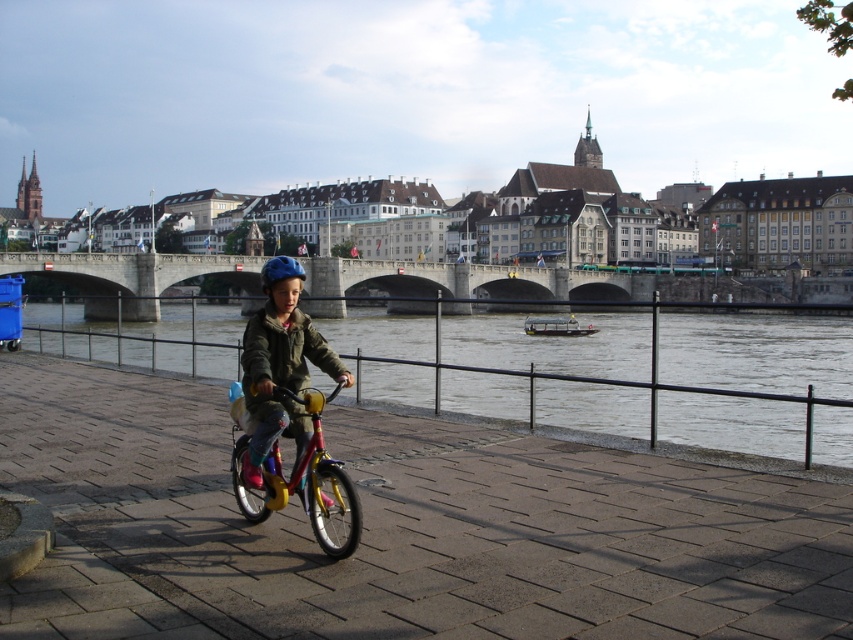
You are a pedestrian standing on the riverside promenade. You see the matte blue helmet at center and the metallic yellow bicycle at center. Which object is closer to you?

The matte blue helmet at center is closer to you because the metallic yellow bicycle at center is behind it.

Based on the photo, you are standing at the starting point of the riverside promenade and want to reach the stone bridge at center. According to the coordinates provided, what are the exact coordinates you need to navigate to?

The exact coordinates for the stone bridge at center are 0.448 on the x axis and 0.553 on the y axis.

You are a photographer trying to capture the child riding the metallic yellow bicycle at center. You notice the matte blue helmet at center is blocking part of the bicycle in your shot. Can you adjust your position to avoid the helmet while keeping the bicycle in frame?

The matte blue helmet at center is larger in size than the metallic yellow bicycle at center, so adjusting your position to avoid the helmet while keeping the bicycle in frame may be challenging due to the helmet being bigger and possibly covering more of the bicycle.